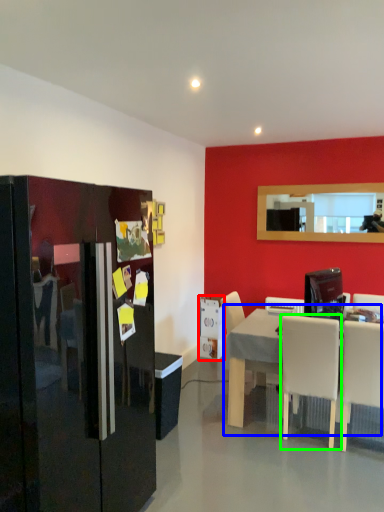
Question: Which object is the farthest from appliance (highlighted by a red box)? Choose among these: table (highlighted by a blue box) or chair (highlighted by a green box).

Choices:
 (A) table
 (B) chair

Answer: (B)